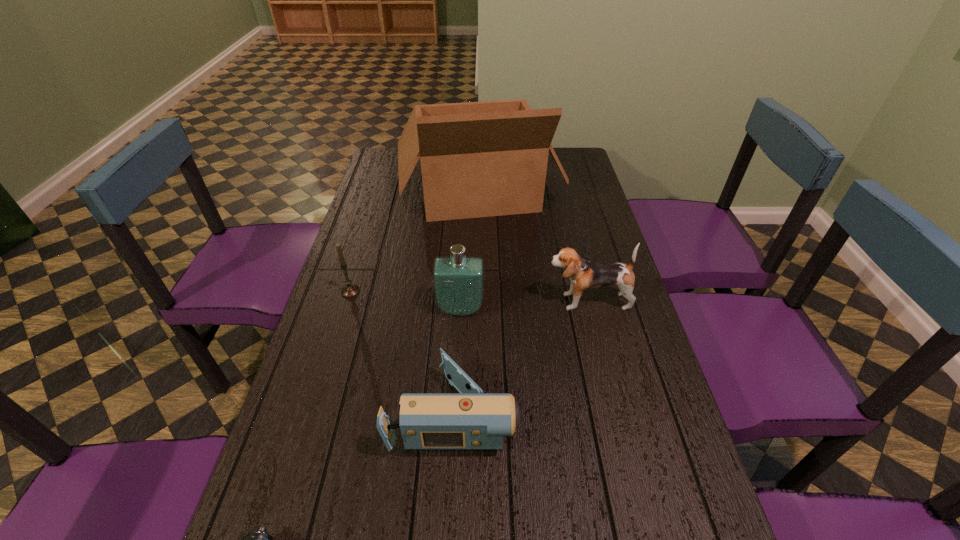
This screenshot has width=960, height=540. Find the location of `the second closest object to the puppy`. the second closest object to the puppy is located at coordinates (470, 420).